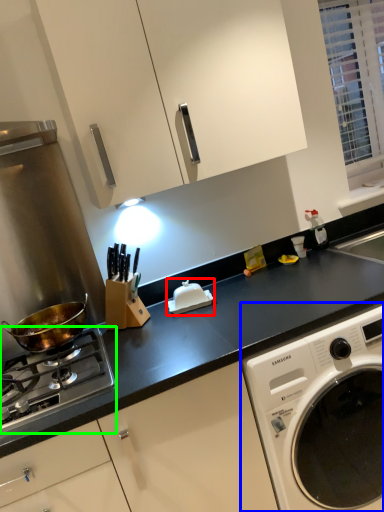
Question: Based on their relative distances, which object is nearer to appliance (highlighted by a red box)? Choose from washing machine (highlighted by a blue box) and gas stove (highlighted by a green box).

Choices:
 (A) washing machine
 (B) gas stove

Answer: (B)